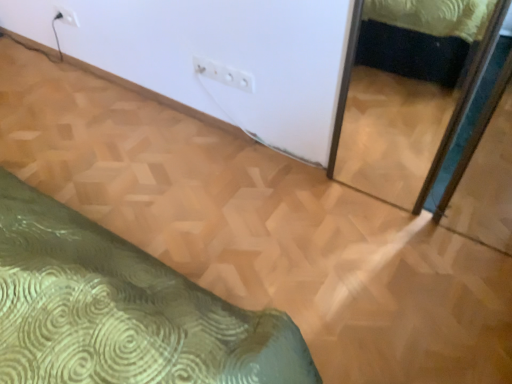
Question: In which direction should I rotate to look at white plastic electric outlet at upper center, placed as the second electric outlet when sorted from left to right?

Choices:
 (A) left
 (B) right

Answer: (A)

Question: Can you confirm if white plastic electric outlet at upper center, which appears as the second electric outlet when viewed from the back, is shorter than white plastic electric outlet at upper left, the second electric outlet when ordered from bottom to top?

Choices:
 (A) no
 (B) yes

Answer: (A)

Question: Is white plastic electric outlet at upper center, the 1th electric outlet positioned from the front, closer to the viewer compared to white plastic electric outlet at upper left, which ranks as the 1th electric outlet in back-to-front order?

Choices:
 (A) no
 (B) yes

Answer: (B)

Question: From the image's perspective, does white plastic electric outlet at upper center, which appears as the 2th electric outlet when viewed from the top, appear higher than white plastic electric outlet at upper left, which is the second electric outlet in front-to-back order?

Choices:
 (A) yes
 (B) no

Answer: (B)

Question: Is white plastic electric outlet at upper center, which is the first electric outlet in bottom-to-top order, positioned behind white plastic electric outlet at upper left, which ranks as the first electric outlet in left-to-right order?

Choices:
 (A) yes
 (B) no

Answer: (B)

Question: Can you confirm if white plastic electric outlet at upper center, placed as the second electric outlet when sorted from left to right, is positioned to the left of white plastic electric outlet at upper left, which is counted as the first electric outlet, starting from the top?

Choices:
 (A) no
 (B) yes

Answer: (A)

Question: Is white plastic electric outlet at upper left, which is the second electric outlet in front-to-back order, inside white plastic electric outlet at upper center, the first electric outlet from the right?

Choices:
 (A) no
 (B) yes

Answer: (A)

Question: Are white plastic electric outlet at upper left, the second electric outlet when ordered from bottom to top, and white plastic electric outlet at upper center, the 1th electric outlet positioned from the front, beside each other?

Choices:
 (A) yes
 (B) no

Answer: (B)

Question: From a real-world perspective, does white plastic electric outlet at upper left, which is the second electric outlet in front-to-back order, sit lower than white plastic electric outlet at upper center, placed as the second electric outlet when sorted from left to right?

Choices:
 (A) yes
 (B) no

Answer: (A)

Question: From a real-world perspective, is white plastic electric outlet at upper left, the second electric outlet when ordered from bottom to top, located higher than white plastic electric outlet at upper center, the 1th electric outlet positioned from the front?

Choices:
 (A) yes
 (B) no

Answer: (B)

Question: Considering the relative sizes of white plastic electric outlet at upper left, which ranks as the first electric outlet in left-to-right order, and white plastic electric outlet at upper center, which is the first electric outlet in bottom-to-top order, in the image provided, is white plastic electric outlet at upper left, which ranks as the first electric outlet in left-to-right order, thinner than white plastic electric outlet at upper center, which is the first electric outlet in bottom-to-top order,?

Choices:
 (A) yes
 (B) no

Answer: (A)

Question: Is white plastic electric outlet at upper left, which is the second electric outlet in front-to-back order, to the left of white plastic electric outlet at upper center, which appears as the second electric outlet when viewed from the back, from the viewer's perspective?

Choices:
 (A) no
 (B) yes

Answer: (B)

Question: Does white plastic electric outlet at upper left, the second electric outlet when ordered from bottom to top, have a greater height compared to white plastic electric outlet at upper center, which is the first electric outlet in bottom-to-top order?

Choices:
 (A) yes
 (B) no

Answer: (B)

Question: From the image's perspective, relative to white plastic electric outlet at upper left, which appears as the 2th electric outlet when viewed from the right, is white plastic electric outlet at upper center, which is the first electric outlet in bottom-to-top order, above or below?

Choices:
 (A) above
 (B) below

Answer: (B)